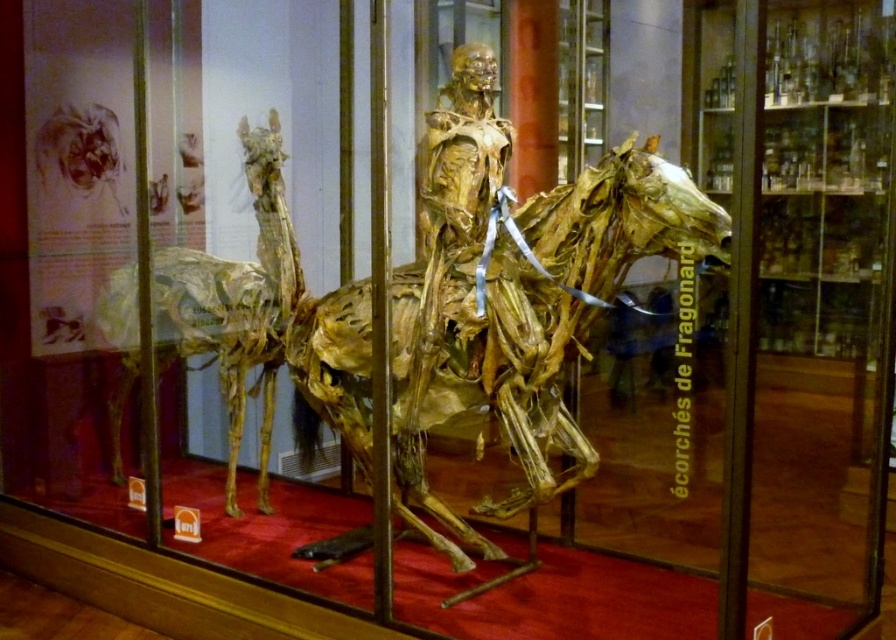
Between brown leather horse at center and gold-brown wood horse at left, which one has more height?

gold-brown wood horse at left is taller.

Is point (470, 244) closer to camera compared to point (263, 314)?

Yes, point (470, 244) is in front of point (263, 314).

At what (x,y) coordinates should I click in order to perform the action: click on brown leather horse at center. Please return your answer as a coordinate pair (x, y). Looking at the image, I should click on (519, 305).